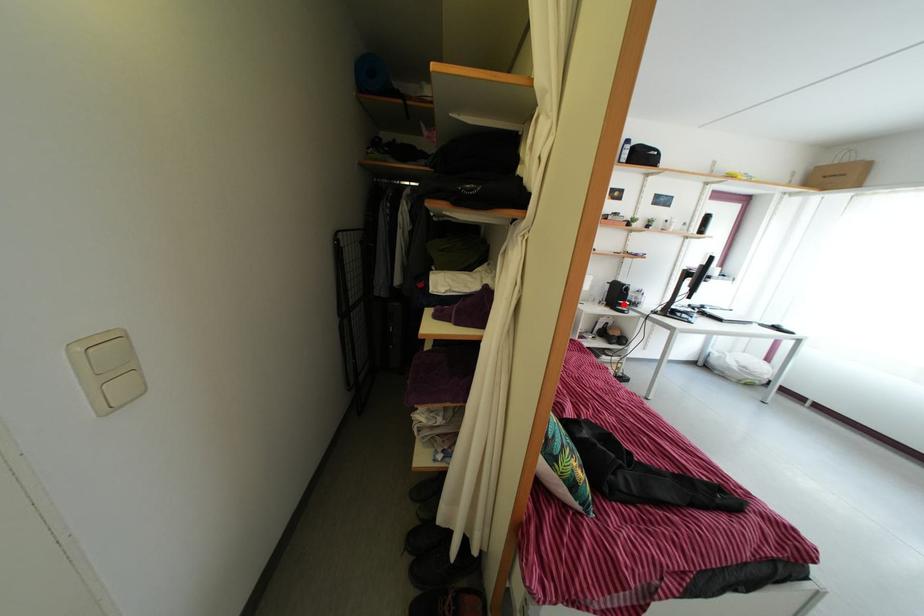
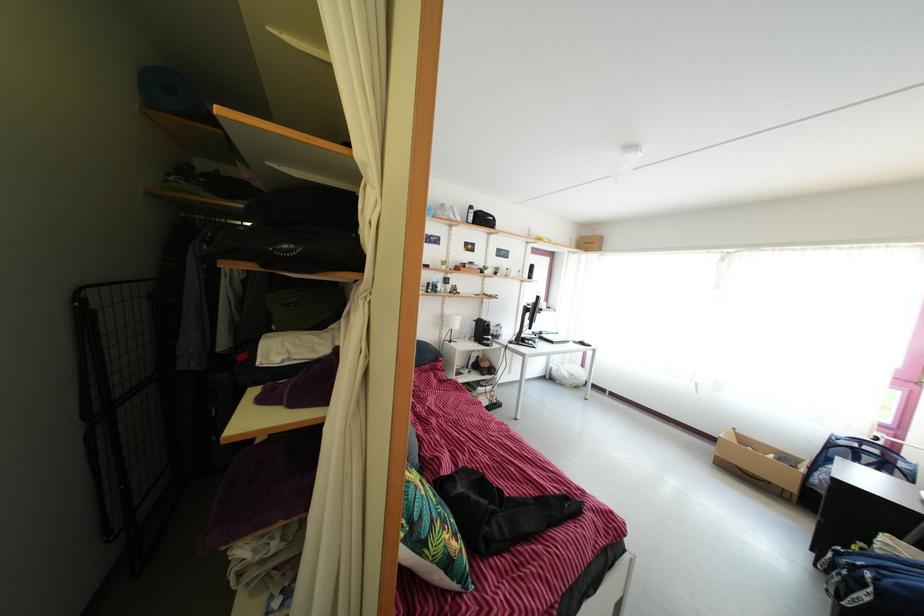
Question: I am providing you with two images of the same scene from different viewpoints. Image1 has a red point marked. In image2, the corresponding 3D location appears at what relative position? Reply with the corresponding letter.

Choices:
 (A) Closer
 (B) Farther

Answer: (B)